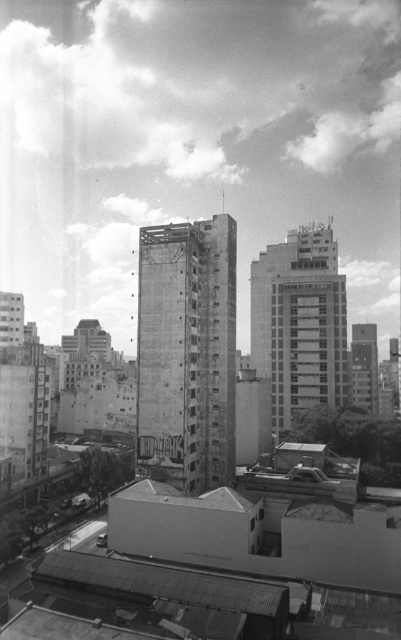
You are an urban planner analyzing the city layout. You need to determine if the concrete building at center can be expanded to match the width of the smooth glass building at center. Based on the current spatial arrangement, is this feasible without altering the adjacent structures?

The concrete building at center is currently narrower than the smooth glass building at center. However, expanding it to match the width would likely require removing or modifying the adjacent structures, which are not mentioned in the scene description. Therefore, it is not feasible without altering the adjacent structures.

You are an architect analyzing the cityscape. You notice the concrete building at center and the smooth glass building at center. Which one appears to be nearer to you in the image?

The concrete building at center is closer to the viewer than the smooth glass building at center, so the concrete building at center appears nearer.

You are an urban planner reviewing this city layout. You need to determine the spatial relationship between the concrete building at center and the smooth glass building at center. Which one is positioned lower in the image?

The concrete building at center is located below the smooth glass building at center, so it is positioned lower in the image.